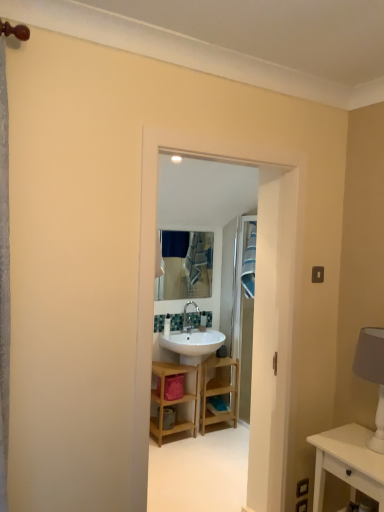
This screenshot has width=384, height=512. Find the location of `vacant region above white wood side table at lower right (from a real-world perspective)`. vacant region above white wood side table at lower right (from a real-world perspective) is located at coordinates [368, 452].